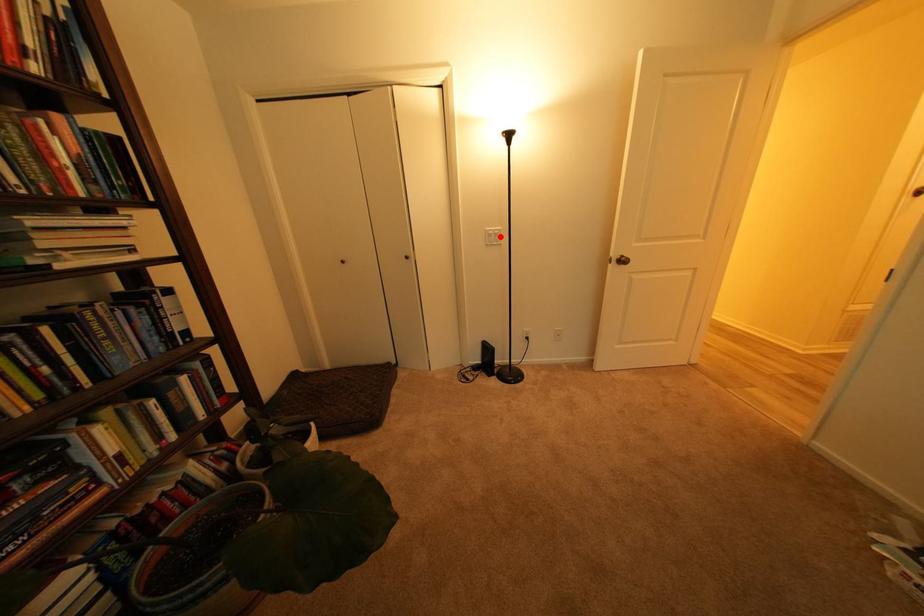
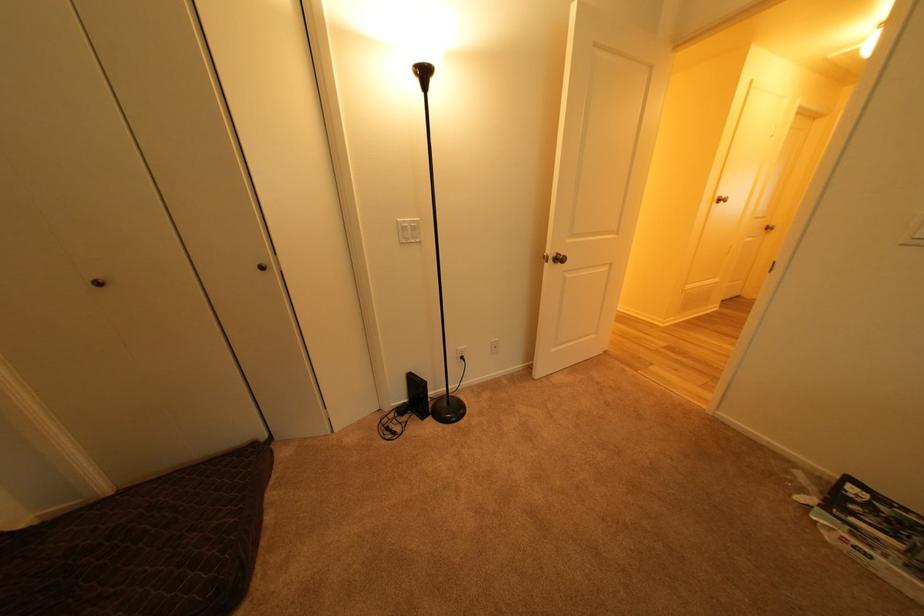
Locate, in the second image, the point that corresponds to the highlighted location in the first image.

(416, 230)